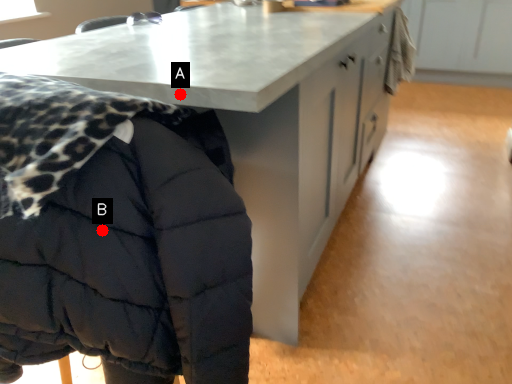
Question: Two points are circled on the image, labeled by A and B beside each circle. Which point appears closest to the camera in this image?

Choices:
 (A) A is closer
 (B) B is closer

Answer: (B)